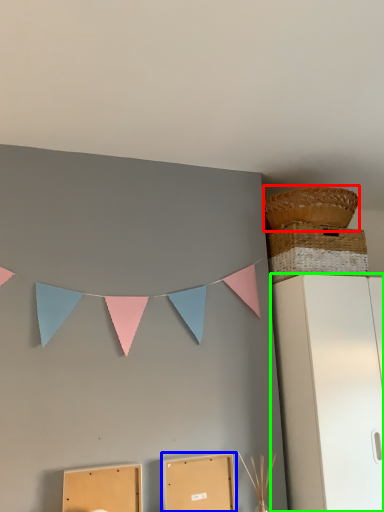
Question: Which is nearer to the basket (highlighted by a red box)? cardboard box (highlighted by a blue box) or furniture (highlighted by a green box).

Choices:
 (A) cardboard box
 (B) furniture

Answer: (B)